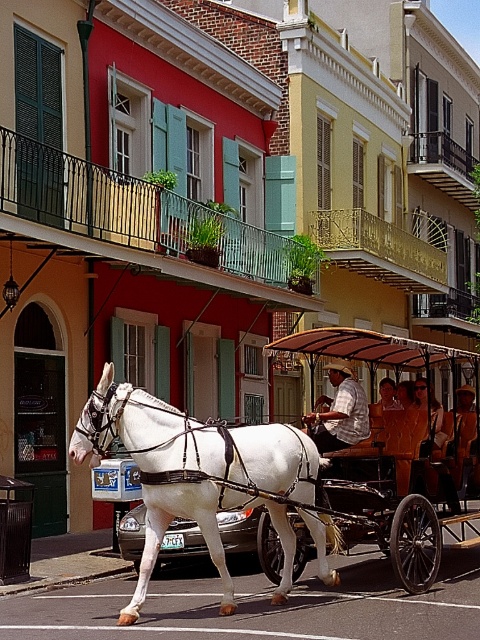
Question: Which object appears farthest from the camera in this image?

Choices:
 (A) white glossy horse at center
 (B) wooden coach at center

Answer: (B)

Question: Is white glossy horse at center in front of wooden coach at center?

Choices:
 (A) no
 (B) yes

Answer: (B)

Question: Is white glossy horse at center further to camera compared to wooden coach at center?

Choices:
 (A) yes
 (B) no

Answer: (B)

Question: Can you confirm if white glossy horse at center is positioned below wooden coach at center?

Choices:
 (A) no
 (B) yes

Answer: (B)

Question: Among these points, which one is nearest to the camera?

Choices:
 (A) (116, 435)
 (B) (363, 412)

Answer: (A)